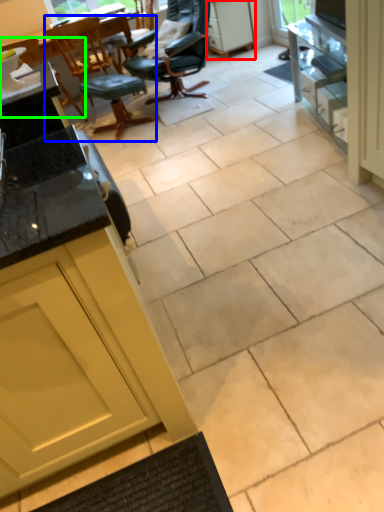
Question: Which is farther away from cabinetry (highlighted by a red box)? chair (highlighted by a blue box) or chair (highlighted by a green box)?

Choices:
 (A) chair
 (B) chair

Answer: (B)